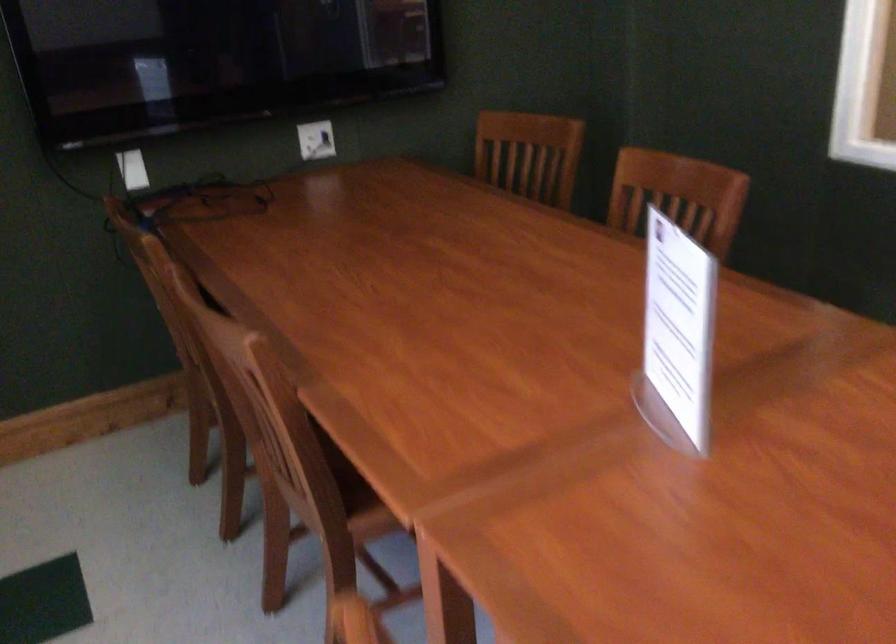
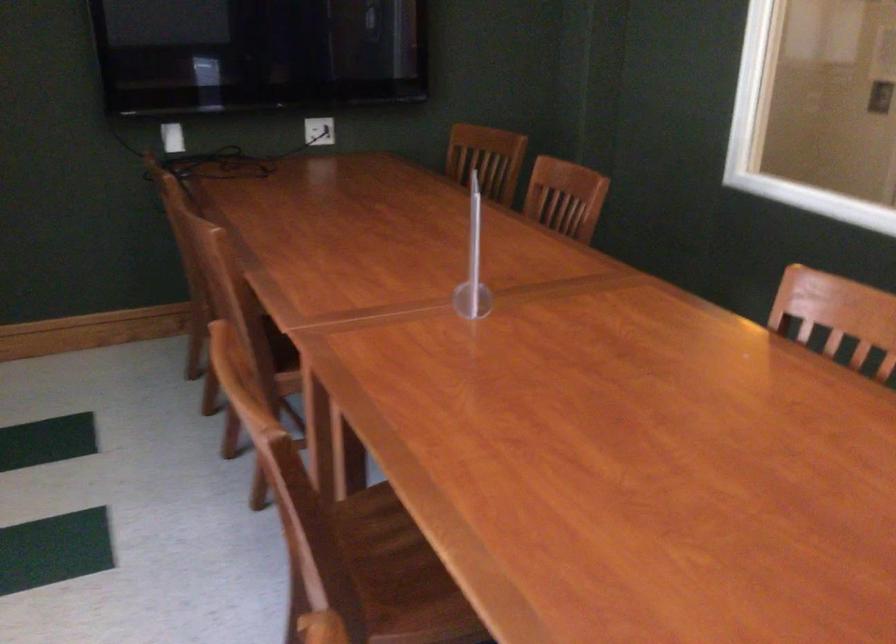
Locate, in the second image, the point that corresponds to the point at 528,156 in the first image.

(487, 158)